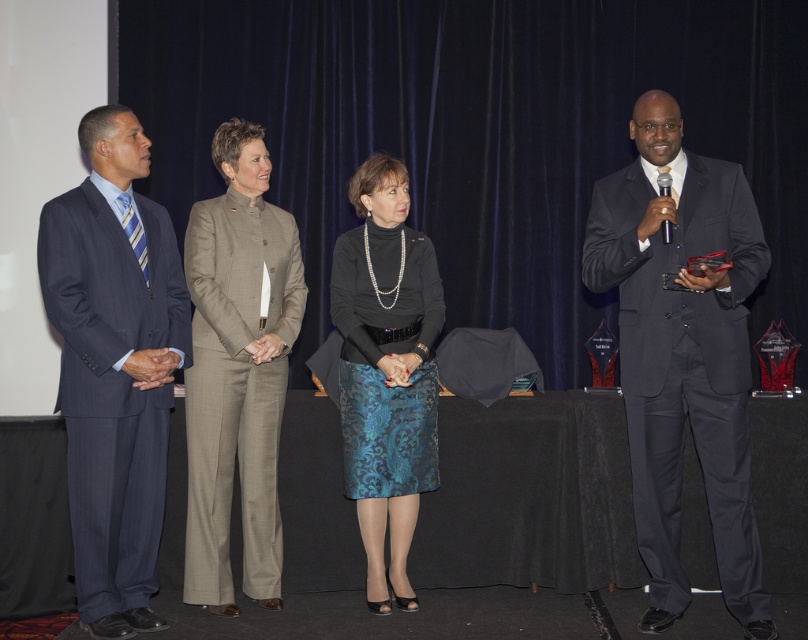
Can you confirm if matte black suit at right is wider than beige woolen suit at center?

Yes.

Does matte black suit at right appear on the right side of beige woolen suit at center?

Indeed, matte black suit at right is positioned on the right side of beige woolen suit at center.

What do you see at coordinates (684, 353) in the screenshot? I see `matte black suit at right` at bounding box center [684, 353].

What are the coordinates of `matte black suit at right` in the screenshot? It's located at (684, 353).

Does dark blue pinstripe suit at left have a larger size compared to matte black blouse at center?

Correct, dark blue pinstripe suit at left is larger in size than matte black blouse at center.

Does dark blue pinstripe suit at left appear on the left side of matte black blouse at center?

Indeed, dark blue pinstripe suit at left is positioned on the left side of matte black blouse at center.

Where is `dark blue pinstripe suit at left`? This screenshot has height=640, width=808. dark blue pinstripe suit at left is located at coordinates (114, 365).

Between matte black suit at right and dark blue pinstripe suit at left, which one has less height?

dark blue pinstripe suit at left

Who is higher up, matte black suit at right or dark blue pinstripe suit at left?

matte black suit at right

Describe the element at coordinates (684, 353) in the screenshot. I see `matte black suit at right` at that location.

Image resolution: width=808 pixels, height=640 pixels. I want to click on matte black suit at right, so click(x=684, y=353).